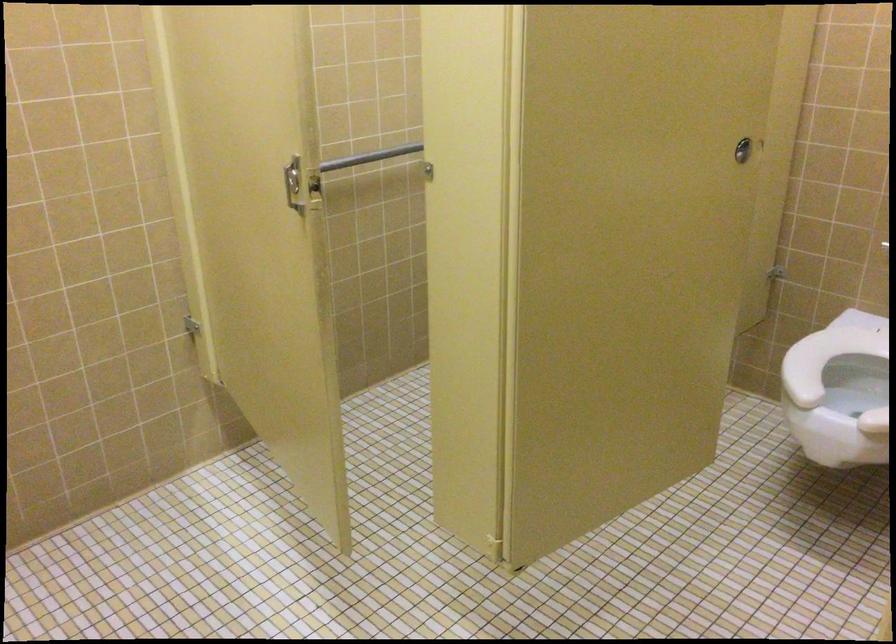
Describe the element at coordinates (743, 149) in the screenshot. I see `a metal door latch` at that location.